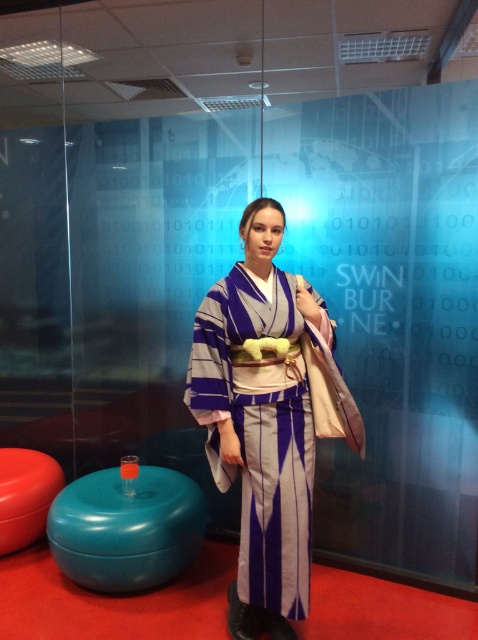
Is silky purple kimono at center closer to the viewer compared to matte red stool at lower left?

Yes.

Which is more to the right, silky purple kimono at center or matte red stool at lower left?

From the viewer's perspective, silky purple kimono at center appears more on the right side.

Who is more forward, [256,385] or [43,452]?

Point [256,385]

You are a GUI agent. You are given a task and a screenshot of the screen. Output one action in this format:
    pyautogui.click(x=<x>, y=<y>)
    Task: Click on the silky purple kimono at center
    This screenshot has height=640, width=478.
    Given the screenshot: What is the action you would take?
    pyautogui.click(x=268, y=417)

Is teal glossy stool at lower left below matte red stool at lower left?

Indeed, teal glossy stool at lower left is positioned under matte red stool at lower left.

Is teal glossy stool at lower left above matte red stool at lower left?

No.

Who is more forward, (79, 540) or (3, 540)?

Point (79, 540) is in front.

This screenshot has height=640, width=478. What are the coordinates of `teal glossy stool at lower left` in the screenshot? It's located at (127, 529).

Who is more forward, (273, 300) or (130, 561)?

Point (273, 300) is more forward.

Is the position of silky purple kimono at center less distant than that of teal glossy stool at lower left?

Yes, it is.

Where is `silky purple kimono at center`? This screenshot has width=478, height=640. silky purple kimono at center is located at coordinates (268, 417).

What are the coordinates of `silky purple kimono at center` in the screenshot? It's located at (268, 417).